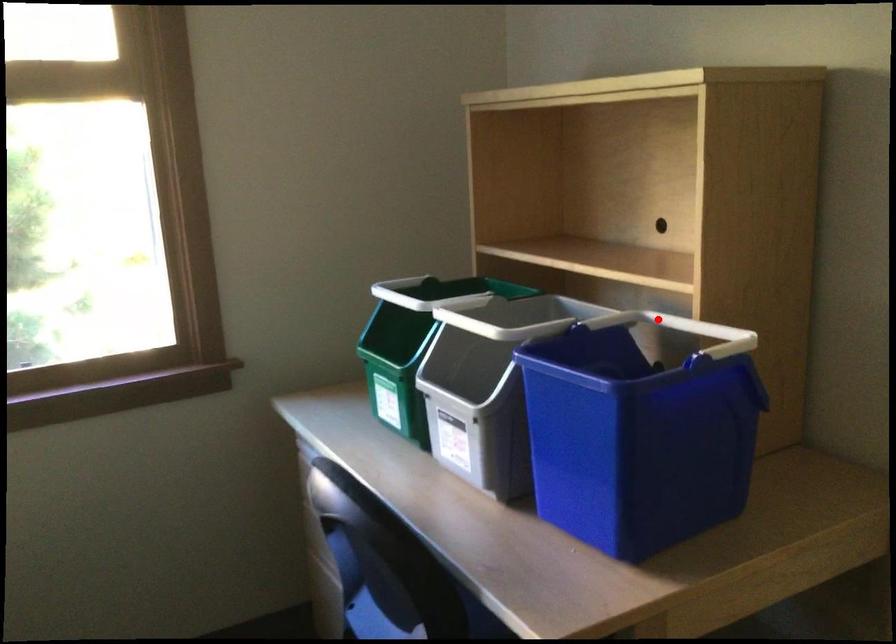
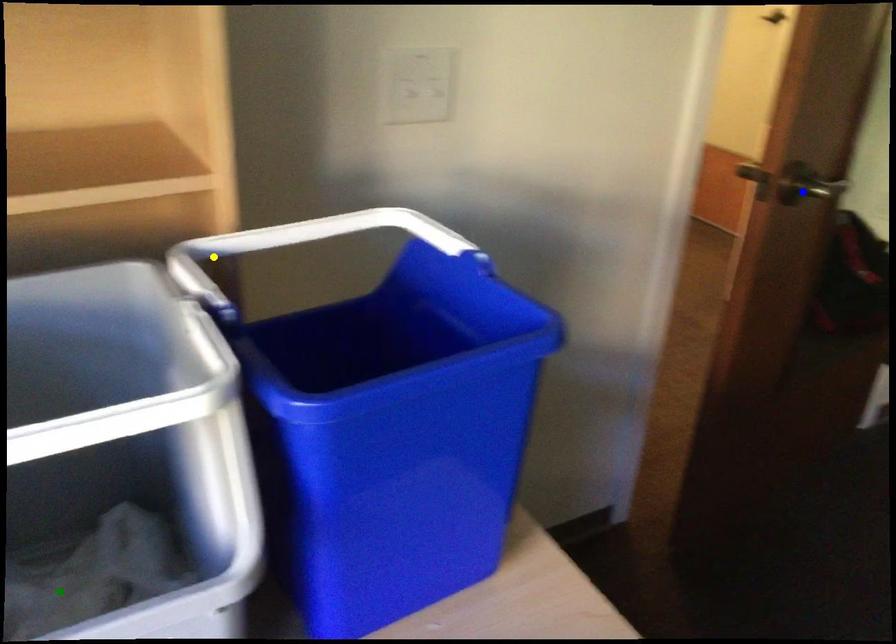
Question: I am providing you with two images of the same scene from different viewpoints. A red point is marked on the first image. You are given multiple points on the second image. Can you choose the point in image 2 that corresponds to the point in image 1?

Choices:
 (A) yellow point
 (B) green point
 (C) blue point

Answer: (A)